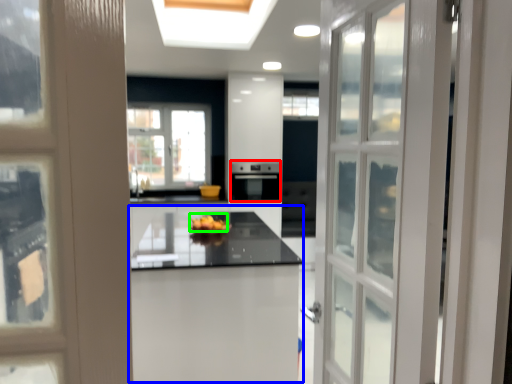
Question: Considering the real-world distances, which object is farthest from appliance (highlighted by a red box)? table (highlighted by a blue box) or fruit (highlighted by a green box)?

Choices:
 (A) table
 (B) fruit

Answer: (A)